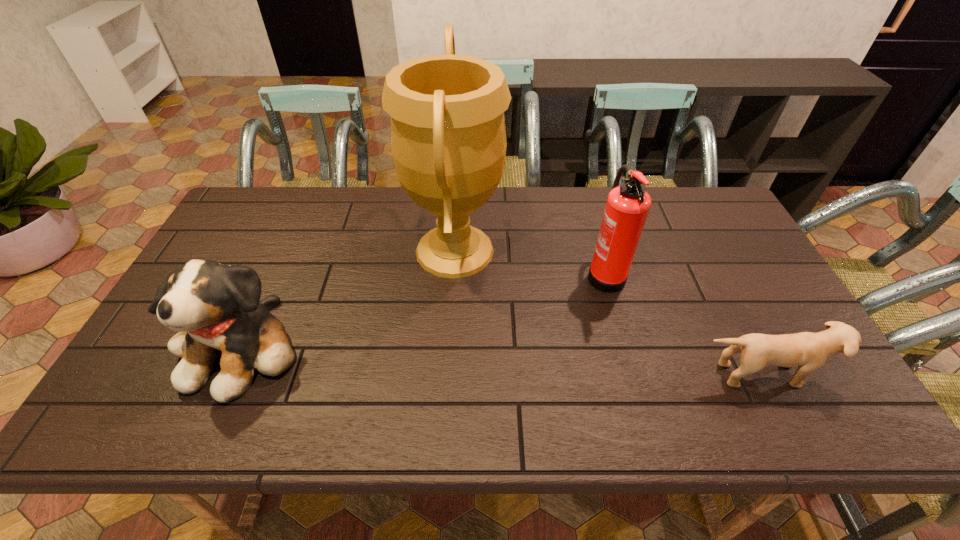
Find the location of a particular element. Image resolution: width=960 pixels, height=540 pixels. vacant area that lies between the trophy and the left puppy is located at coordinates pos(348,299).

Where is `free space between the shortest object and the fire extinguisher`? Image resolution: width=960 pixels, height=540 pixels. free space between the shortest object and the fire extinguisher is located at coordinates (683, 323).

Locate which object ranks third in proximity to the second object from right to left. Please provide its 2D coordinates. Your answer should be formatted as a tuple, i.e. [(x, y)], where the tuple contains the x and y coordinates of a point satisfying the conditions above.

[(216, 309)]

Identify the location of the closest object to the third object from left to right. Image resolution: width=960 pixels, height=540 pixels. (809, 351).

At what (x,y) coordinates should I click in order to perform the action: click on free space that satisfies the following two spatial constraints: 1. at the nozzle of the fire extinguisher; 2. at the face of the leftmost object. Please return your answer as a coordinate pair (x, y). Looking at the image, I should click on (625, 348).